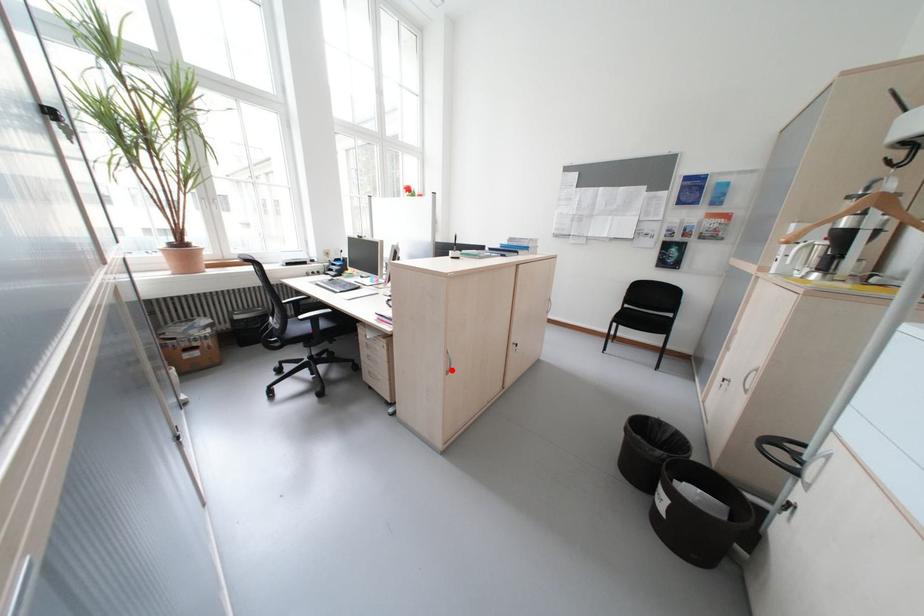
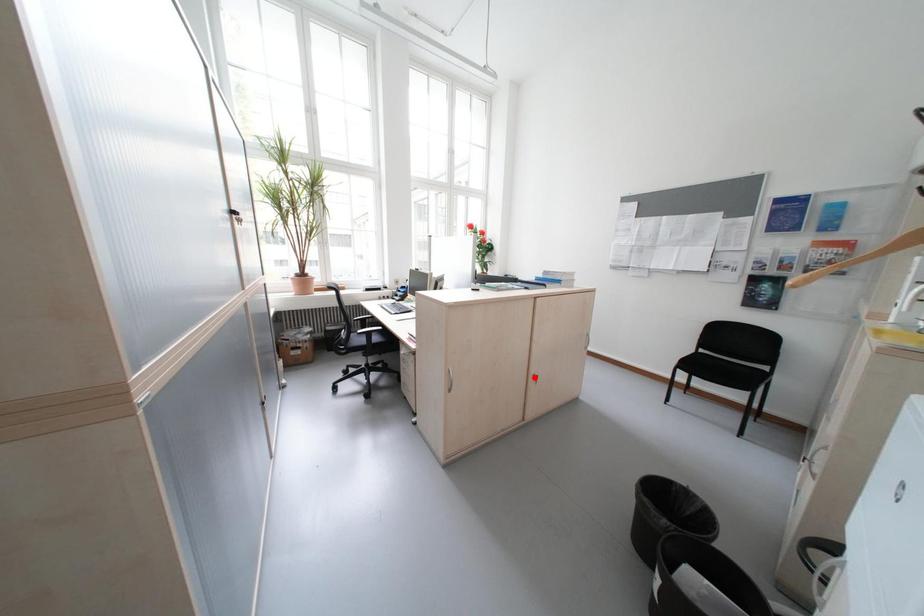
I am providing you with two images of the same scene from different viewpoints. A red point is marked on the first image and another point is marked on the second image. Are the points marked in image1 and image2 representing the same 3D position?

No